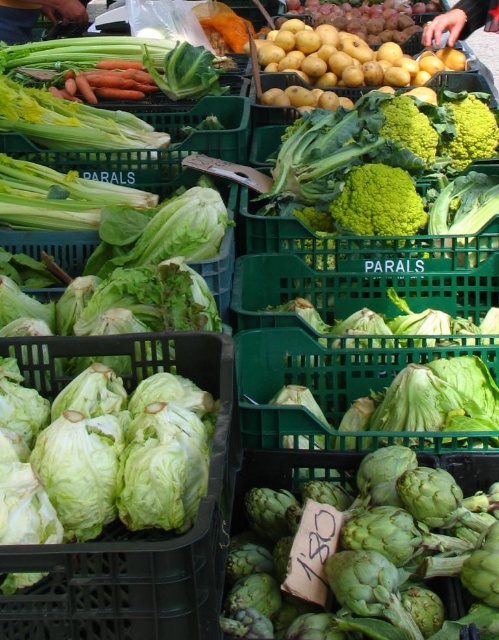
Question: Which of the following is the closest to the observer?

Choices:
 (A) green rough artichoke at center
 (B) smooth yellow skin at upper right
 (C) smooth yellow potatoes at upper center
 (D) dark brown leather handbag at upper left

Answer: (A)

Question: Which object appears farthest from the camera in this image?

Choices:
 (A) smooth yellow potatoes at upper center
 (B) orange smooth carrots at upper left

Answer: (A)

Question: Can you confirm if smooth yellow potatoes at upper center is wider than orange smooth carrots at upper left?

Choices:
 (A) no
 (B) yes

Answer: (B)

Question: Which of these objects is positioned farthest from the orange smooth carrots at upper left?

Choices:
 (A) smooth yellow potatoes at upper center
 (B) green rough artichoke at center

Answer: (B)

Question: Is green rough artichoke at center behind dark brown leather handbag at upper left?

Choices:
 (A) no
 (B) yes

Answer: (A)

Question: Can you confirm if green rough artichoke at center is smaller than smooth yellow skin at upper right?

Choices:
 (A) yes
 (B) no

Answer: (B)